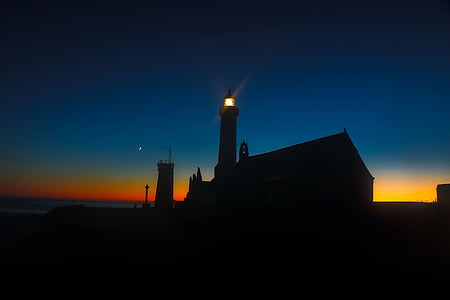
Where is `light`? The height and width of the screenshot is (300, 450). light is located at coordinates (420, 192).